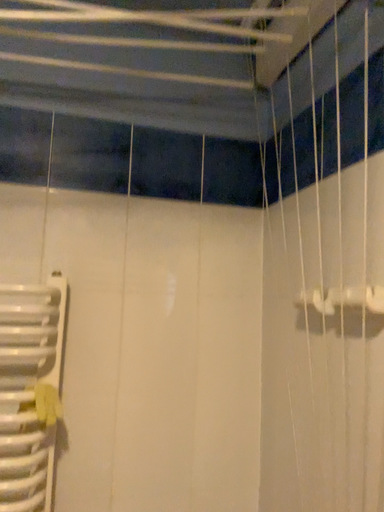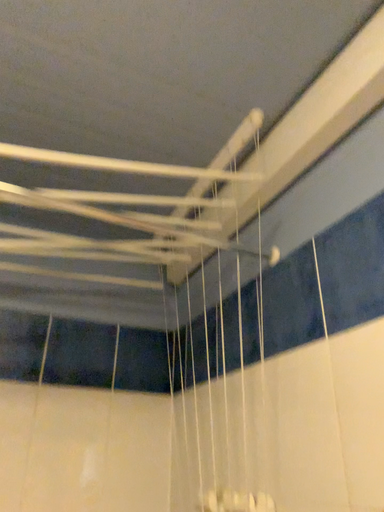
Question: How did the camera likely rotate when shooting the video?

Choices:
 (A) rotated upward
 (B) rotated downward

Answer: (A)